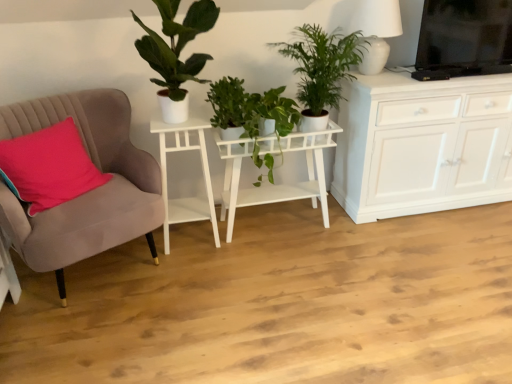
The width and height of the screenshot is (512, 384). I want to click on vacant space to the right of suede armchair at left, so click(x=220, y=290).